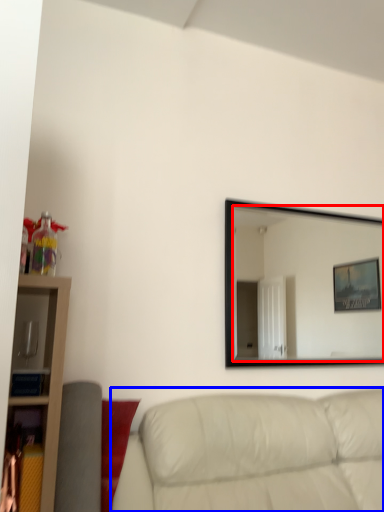
Question: Which object is closer to the camera taking this photo, mirror (highlighted by a red box) or studio couch (highlighted by a blue box)?

Choices:
 (A) mirror
 (B) studio couch

Answer: (B)